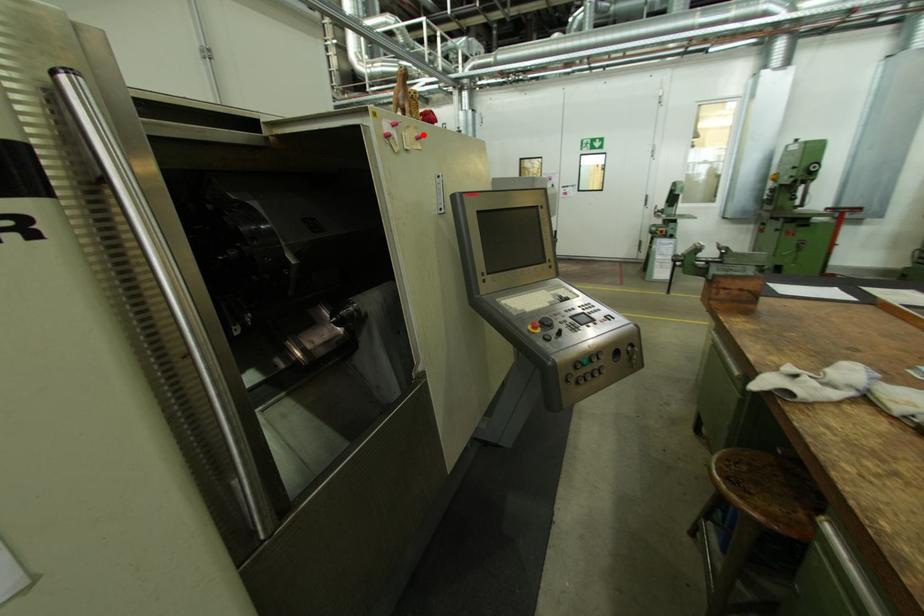
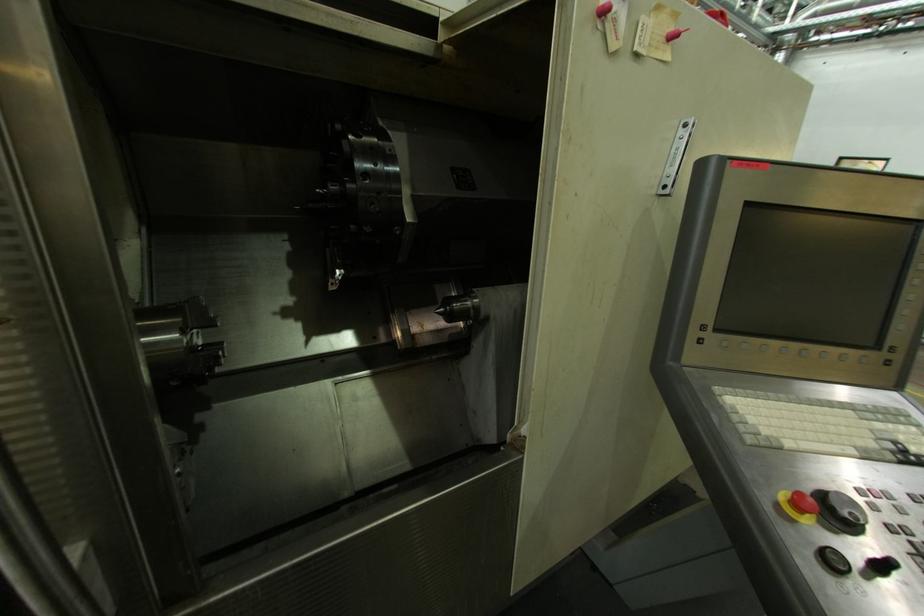
Question: I am providing you with two images of the same scene from different viewpoints. Image1 has a red point marked. In image2, the corresponding 3D location appears at what relative position? Reply with the corresponding letter.

Choices:
 (A) Closer
 (B) Farther

Answer: (B)